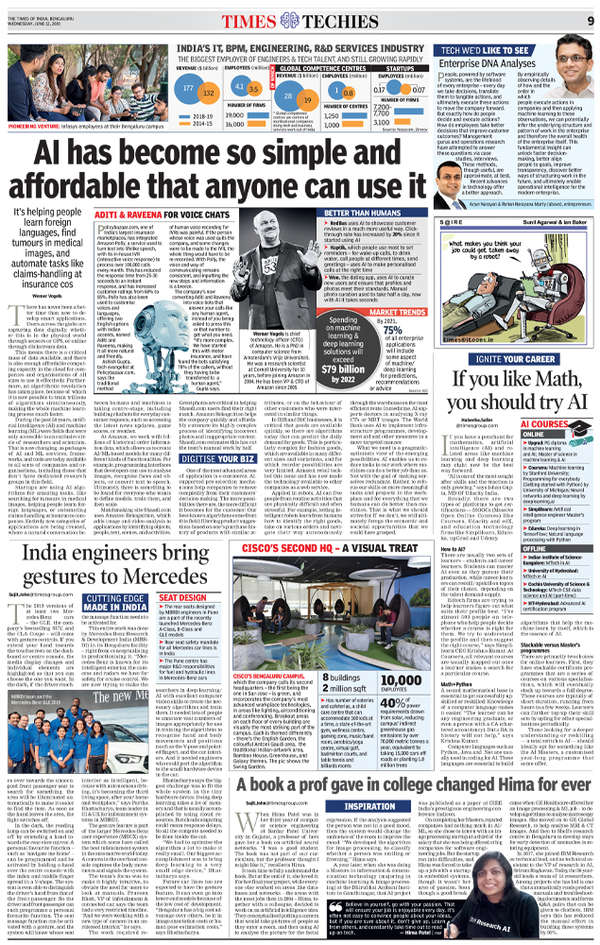
Where is `diploma`? diploma is located at coordinates (579, 441).